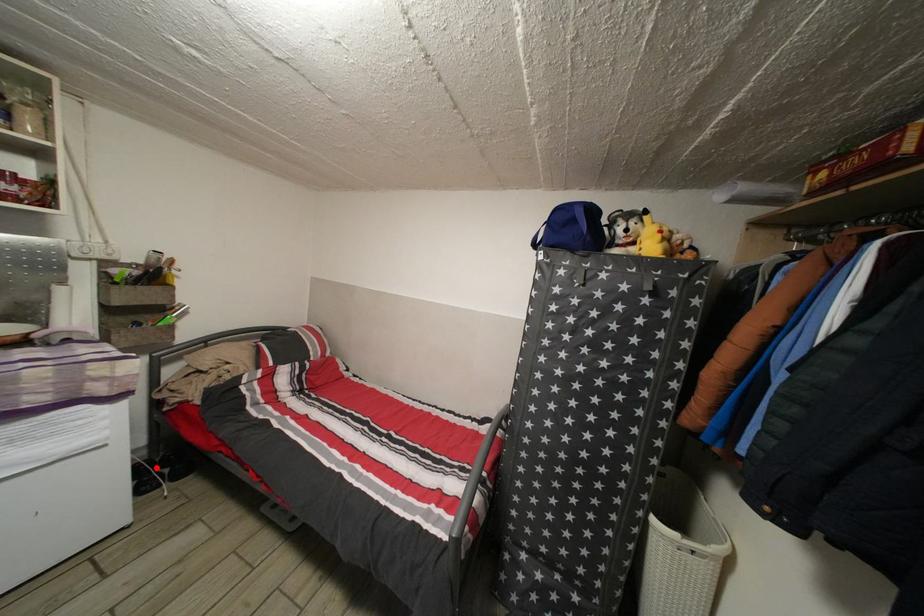
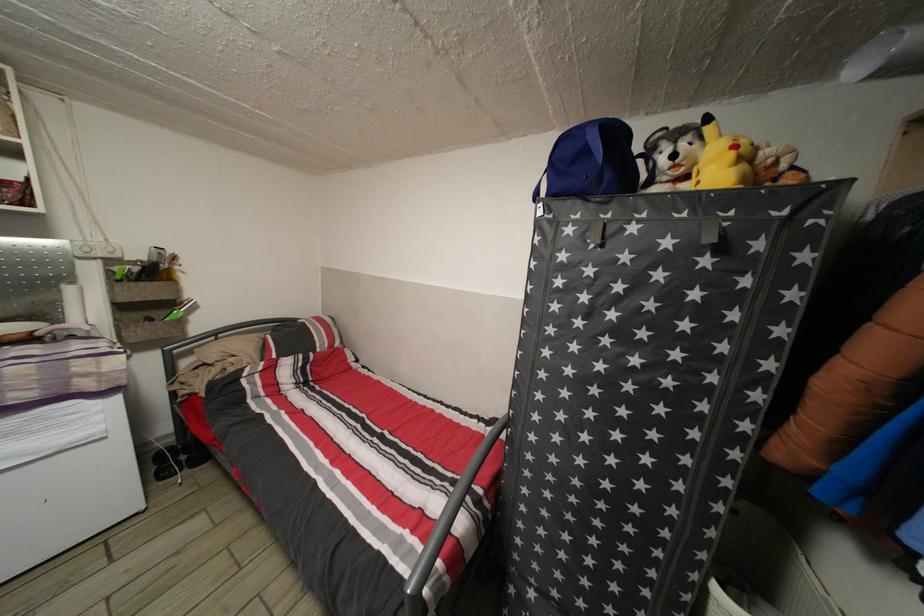
The point at the highlighted location is marked in the first image. Where is the corresponding point in the second image?

(177, 455)